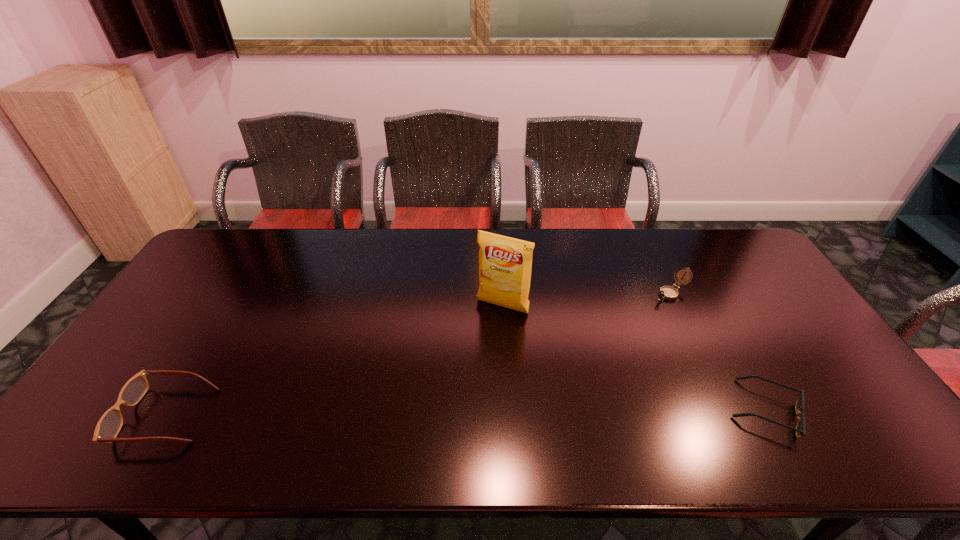
Locate an element on the screen. free space on the desktop that is between the spectacles and the shortest object and is positioned on the front of the tallest object with the logo is located at coordinates [x=447, y=413].

This screenshot has height=540, width=960. I want to click on free space on the desktop that is between the second shortest object and the sunglasses and is positioned on the face of the second tallest object, so click(x=501, y=412).